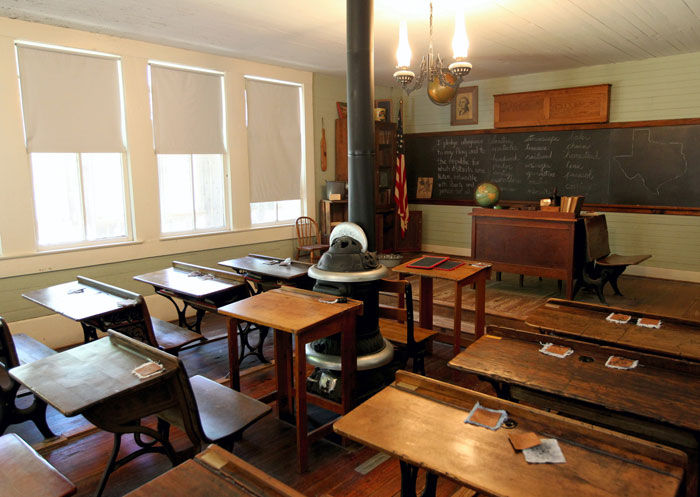
The height and width of the screenshot is (497, 700). In order to click on floor in this screenshot , I will do `click(370, 482)`.